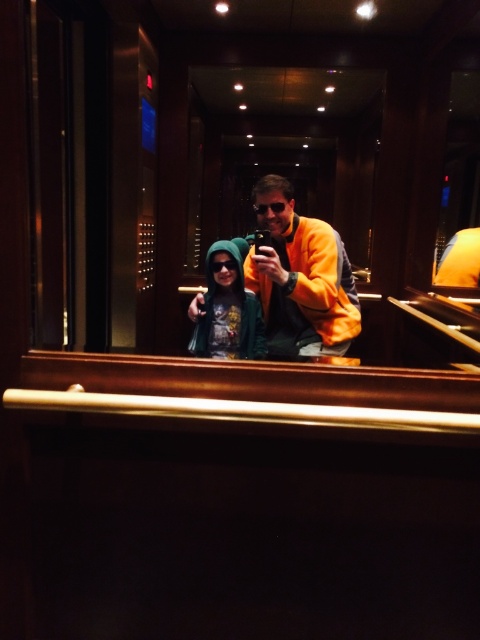
Question: Which point is closer to the camera taking this photo?

Choices:
 (A) (219, 264)
 (B) (296, 339)

Answer: (B)

Question: Which point appears closest to the camera in this image?

Choices:
 (A) (348, 275)
 (B) (252, 324)

Answer: (A)

Question: Is yellow fleece jacket at center smaller than green hoodie at center?

Choices:
 (A) no
 (B) yes

Answer: (A)

Question: Can you confirm if yellow fleece jacket at center is thinner than green hoodie at center?

Choices:
 (A) yes
 (B) no

Answer: (B)

Question: Which object is farther from the camera taking this photo?

Choices:
 (A) yellow fleece jacket at center
 (B) green hoodie at center

Answer: (B)

Question: Can you confirm if yellow fleece jacket at center is wider than green hoodie at center?

Choices:
 (A) yes
 (B) no

Answer: (A)